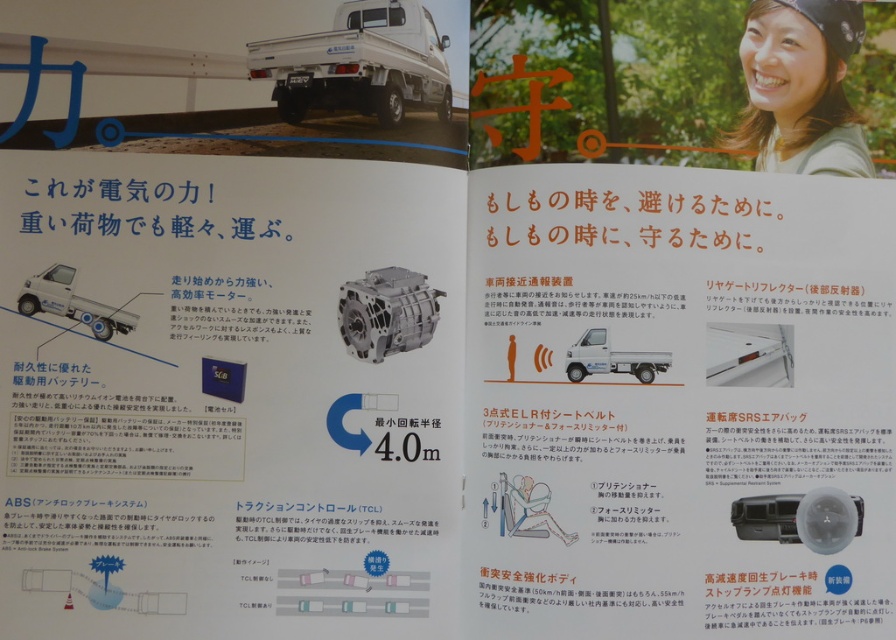
Which of these two, white plastic reflector at center right or white matte truck at center, stands shorter?

Standing shorter between the two is white matte truck at center.

You are a GUI agent. You are given a task and a screenshot of the screen. Output one action in this format:
    pyautogui.click(x=<x>, y=<y>)
    Task: Click on the white plastic reflector at center right
    
    Given the screenshot: What is the action you would take?
    pyautogui.click(x=748, y=355)

Can you confirm if white matte truck at center is positioned above matte black airbag at lower center?

Yes, white matte truck at center is above matte black airbag at lower center.

Measure the distance between point (650, 353) and camera.

Point (650, 353) is 4.39 feet away from camera.

The height and width of the screenshot is (640, 896). What are the coordinates of `white matte truck at center` in the screenshot? It's located at (610, 358).

Is white matte truck at left above matte black airbag at lower center?

Yes.

Which is below, white matte truck at left or matte black airbag at lower center?

Positioned lower is matte black airbag at lower center.

Where is `white matte truck at left`? The height and width of the screenshot is (640, 896). white matte truck at left is located at coordinates (71, 301).